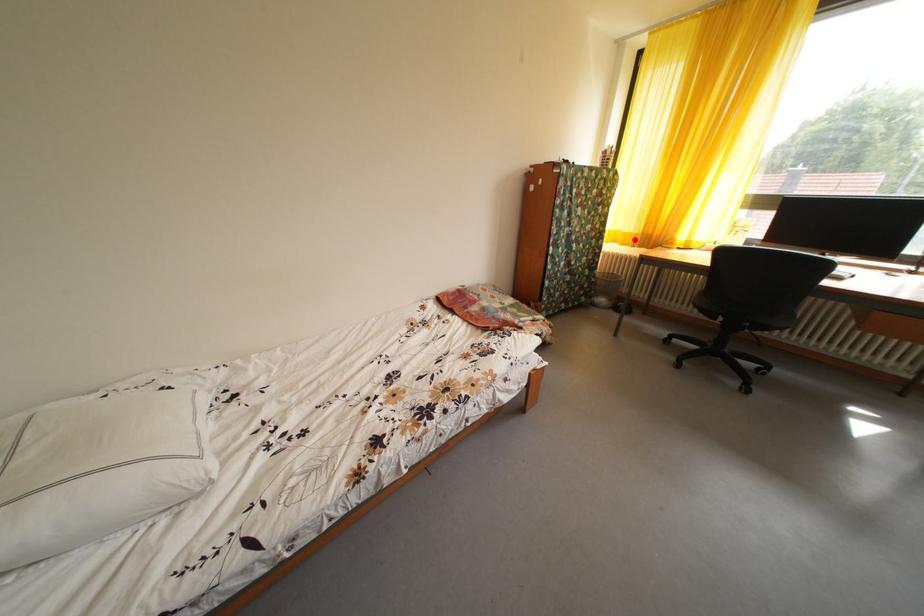
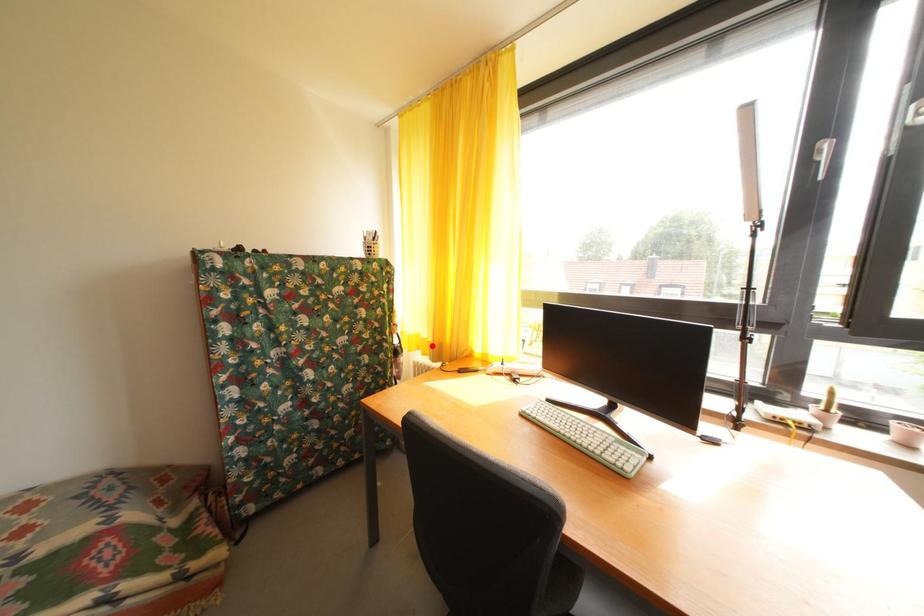
I am providing you with two images of the same scene from different viewpoints. A red point is marked on the first image and another point is marked on the second image. Is the marked point in image1 the same physical position as the marked point in image2?

Yes